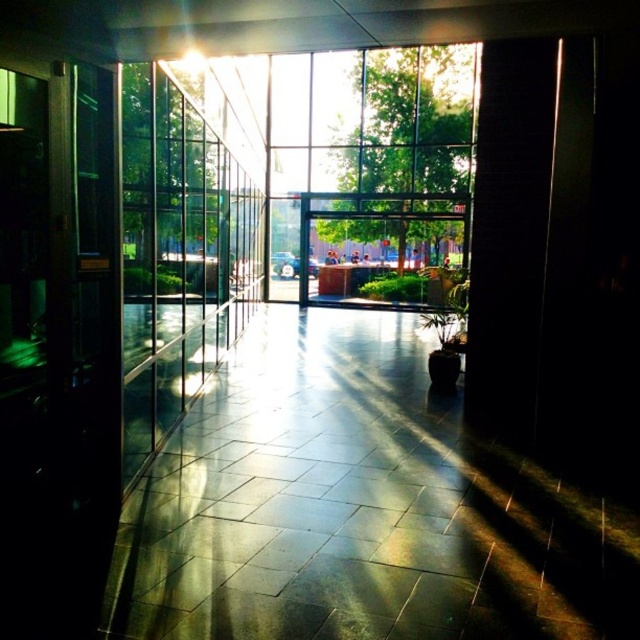
Who is more forward, (179,547) or (192,193)?

Point (179,547) is more forward.

Is shiny tile floor at center to the left of transparent glass door at left from the viewer's perspective?

No, shiny tile floor at center is not to the left of transparent glass door at left.

Is point (488, 625) farther from viewer compared to point (131, 384)?

No, (488, 625) is closer to viewer.

Identify the location of shiny tile floor at center. (356, 508).

Can you confirm if shiny tile floor at center is taller than transparent glass window at center?

Incorrect, shiny tile floor at center's height is not larger of transparent glass window at center's.

Does point (604, 547) come in front of point (305, 132)?

Yes, it is in front of point (305, 132).

At what (x,y) coordinates should I click in order to perform the action: click on shiny tile floor at center. Please return your answer as a coordinate pair (x, y). Looking at the image, I should click on (356, 508).

Locate an element on the screen. shiny tile floor at center is located at coordinates (356, 508).

Looking at this image, can you confirm if transparent glass window at center is positioned below transparent glass door at left?

Incorrect, transparent glass window at center is not positioned below transparent glass door at left.

Between point (355, 257) and point (125, 275), which one is positioned behind?

Point (355, 257)

At what (x,y) coordinates should I click in order to perform the action: click on transparent glass window at center. Please return your answer as a coordinate pair (x, y). Looking at the image, I should click on (369, 164).